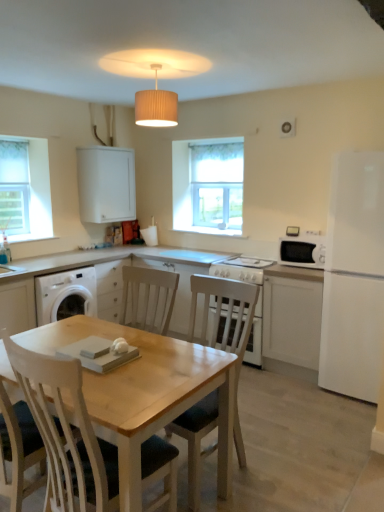
Question: Is white fabric window screen at left further to the viewer compared to white matte cabinet at right, which is the first cabinetry from bottom to top?

Choices:
 (A) no
 (B) yes

Answer: (B)

Question: From the image's perspective, is white fabric window screen at left above white matte cabinet at right, which is the first cabinetry from bottom to top?

Choices:
 (A) yes
 (B) no

Answer: (A)

Question: Is white fabric window screen at left next to white matte cabinet at right, positioned as the second cabinetry in left-to-right order?

Choices:
 (A) yes
 (B) no

Answer: (B)

Question: Can you confirm if white fabric window screen at left is shorter than white matte cabinet at right, positioned as the 1th cabinetry in right-to-left order?

Choices:
 (A) yes
 (B) no

Answer: (B)

Question: Considering the relative sizes of white fabric window screen at left and white matte cabinet at right, marked as the 2th cabinetry in a back-to-front arrangement, in the image provided, is white fabric window screen at left bigger than white matte cabinet at right, marked as the 2th cabinetry in a back-to-front arrangement,?

Choices:
 (A) yes
 (B) no

Answer: (B)

Question: Is white fabric window screen at left far away from white matte cabinet at right, which is the second cabinetry from top to bottom?

Choices:
 (A) yes
 (B) no

Answer: (A)

Question: From the image's perspective, would you say white glass window at center is shown under beige pleated shade at upper center?

Choices:
 (A) no
 (B) yes

Answer: (B)

Question: Does white glass window at center have a smaller size compared to beige pleated shade at upper center?

Choices:
 (A) no
 (B) yes

Answer: (A)

Question: Is white glass window at center with beige pleated shade at upper center?

Choices:
 (A) no
 (B) yes

Answer: (A)

Question: Could you tell me if white glass window at center is facing beige pleated shade at upper center?

Choices:
 (A) yes
 (B) no

Answer: (A)

Question: From the image's perspective, is white glass window at center on top of beige pleated shade at upper center?

Choices:
 (A) yes
 (B) no

Answer: (B)

Question: Is white glass window at center facing away from beige pleated shade at upper center?

Choices:
 (A) yes
 (B) no

Answer: (B)

Question: Considering the relative positions of white matte cabinet at right, which is the second cabinetry from top to bottom, and light wood chair at center in the image provided, is white matte cabinet at right, which is the second cabinetry from top to bottom, behind light wood chair at center?

Choices:
 (A) yes
 (B) no

Answer: (A)